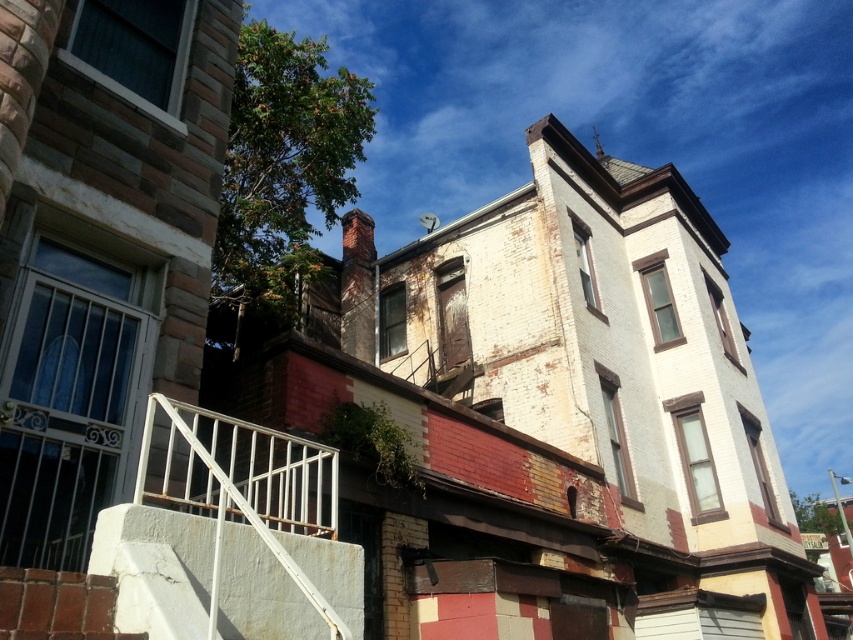
Locate an element on the screen. The height and width of the screenshot is (640, 853). white concrete stairs at lower left is located at coordinates (155, 568).

Can you confirm if white concrete stairs at lower left is wider than white metal railing at lower left?

Incorrect, white concrete stairs at lower left's width does not surpass white metal railing at lower left's.

I want to click on white concrete stairs at lower left, so click(x=155, y=568).